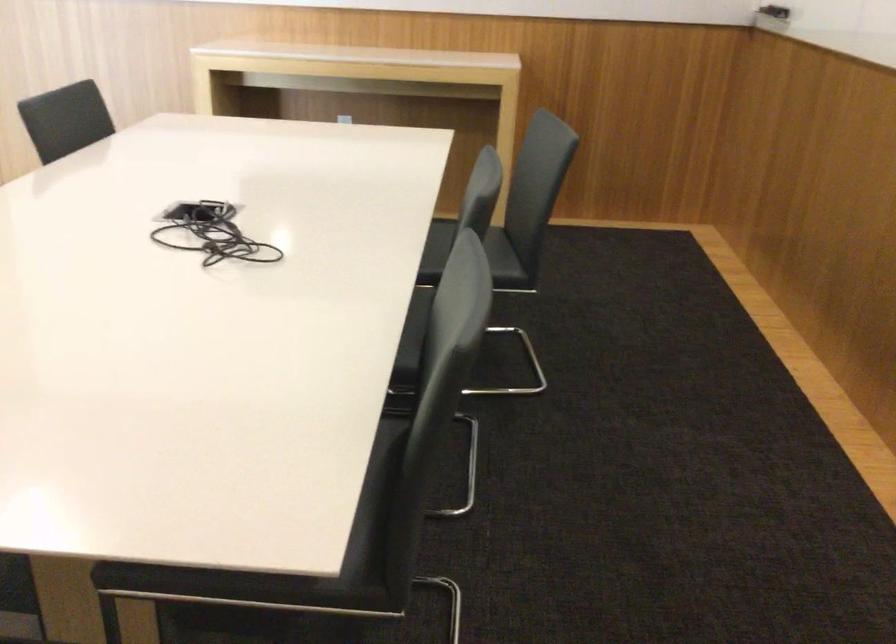
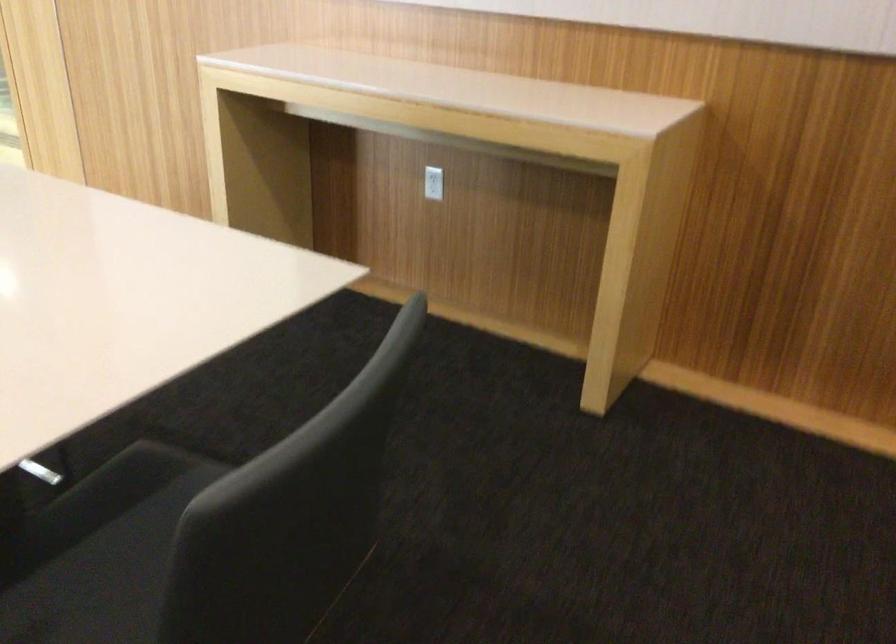
Where in the second image is the point corresponding to pixel 336 115 from the first image?

(433, 183)